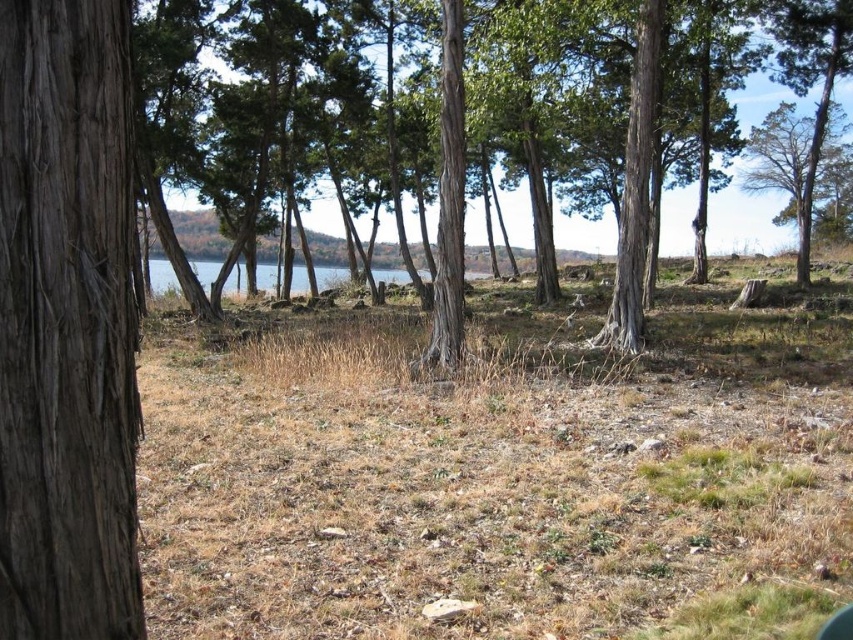
Is brown rough bark tree at left smaller than green rough bark tree at center?

Correct, brown rough bark tree at left occupies less space than green rough bark tree at center.

Between point (50, 522) and point (635, 188), which one is positioned behind?

The point (635, 188) is more distant.

Identify the location of brown rough bark tree at left. The height and width of the screenshot is (640, 853). (67, 323).

I want to click on brown rough bark tree at left, so click(x=67, y=323).